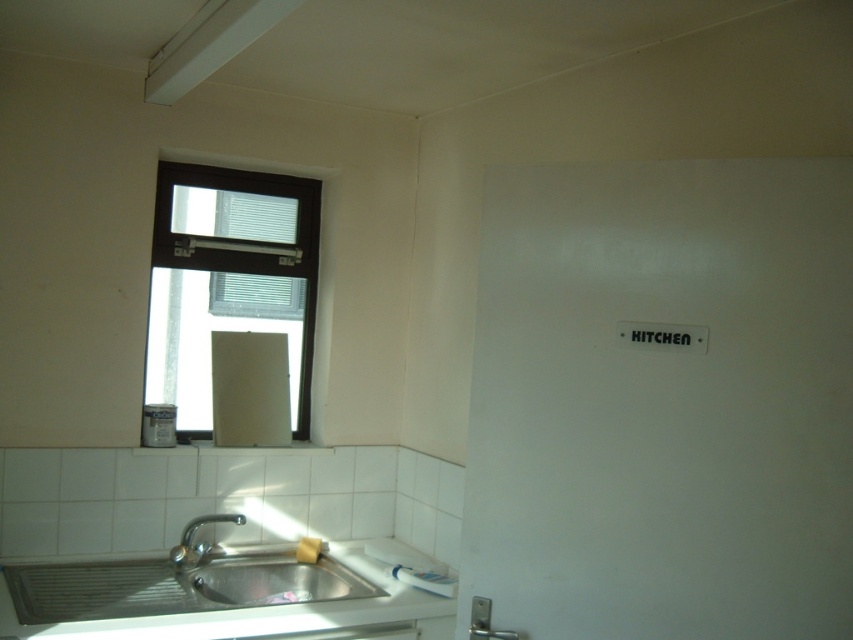
Question: Based on their relative distances, which object is farther from the white glossy countertop at lower left?

Choices:
 (A) brown matte window at upper left
 (B) satin nickel faucet at sink left

Answer: (A)

Question: Where is brown matte window at upper left located in relation to white glossy countertop at lower left in the image?

Choices:
 (A) right
 (B) left

Answer: (B)

Question: Estimate the real-world distances between objects in this image. Which object is closer to the brown matte window at upper left?

Choices:
 (A) white glossy countertop at lower left
 (B) satin nickel faucet at sink left

Answer: (B)

Question: Can you confirm if brown matte window at upper left is thinner than satin nickel faucet at sink left?

Choices:
 (A) yes
 (B) no

Answer: (B)

Question: Which point appears closest to the camera in this image?

Choices:
 (A) click(196, 552)
 (B) click(206, 211)
 (C) click(28, 618)

Answer: (C)

Question: Does white glossy countertop at lower left appear on the right side of satin nickel faucet at sink left?

Choices:
 (A) no
 (B) yes

Answer: (B)